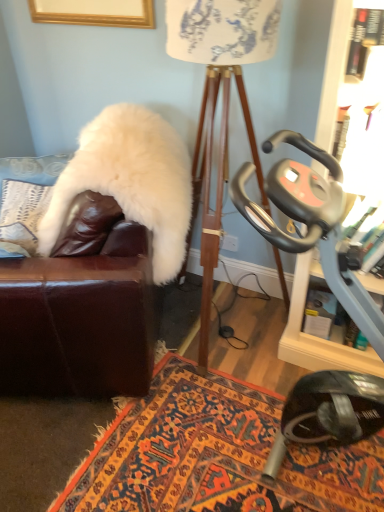
You are a GUI agent. You are given a task and a screenshot of the screen. Output one action in this format:
    pyautogui.click(x=<x>, y=<y>)
    Task: Click on the vacant space underneath white fabric lampshade at center (from a real-world perspective)
    
    Given the screenshot: What is the action you would take?
    (224, 333)